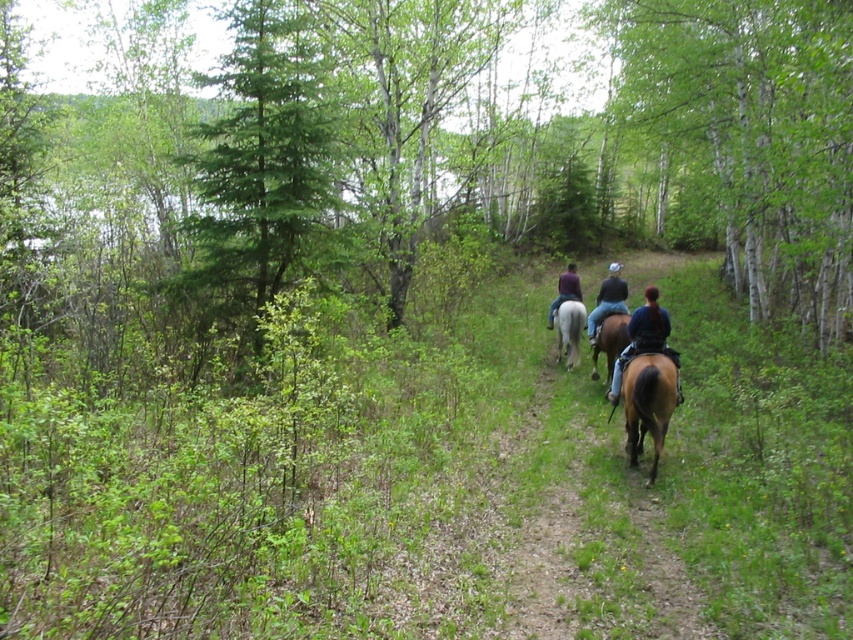
Looking at this image, you are a photographer planning to take a photo of the brown leather horse at center and the purple fabric at center in the scene. Since you want both subjects to appear in focus, you need to know their distance apart. Can you determine if they are close enough for the same depth of field?

The brown leather horse at center has a larger size compared to purple fabric at center, but their exact distance apart isn not specified. Without knowing the separation between them, it is impossible to determine if they can be captured in the same depth of field.

You are a photographer planning to take a group photo of the brown glossy horse at lower center and the dark brown leather jacket at center. If you want to ensure both subjects are fully visible in the frame, which subject should you position closer to the camera?

The brown glossy horse at lower center should be positioned closer to the camera because its width is less than the dark brown leather jacket at center, so it requires less space in the frame to be fully visible.

You are standing at the camera position and see the point at coordinates (607, 300) in the image. What object is located at that point?

The point at coordinates (607, 300) is located on the dark blue denim jacket at center.